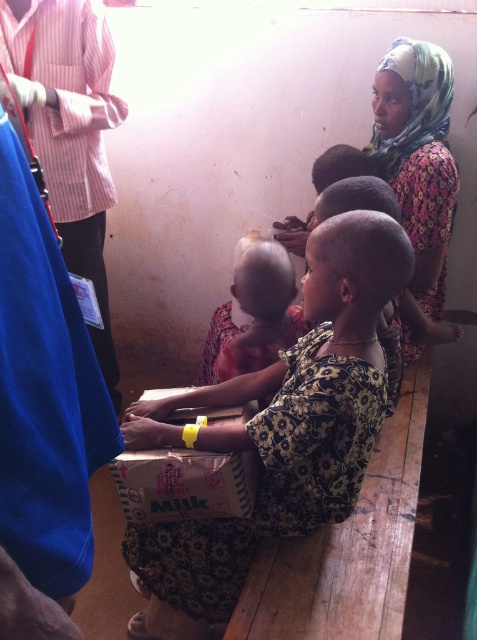
You are a photographer trying to capture the smooth skin baby at center without any obstructions. The floral fabric headscarf at upper right is in your way. Can you adjust your angle to avoid the headscarf?

The floral fabric headscarf at upper right is positioned over the smooth skin baby at center, so adjusting your angle to avoid the headscarf might be possible by moving to a side where the headscarf is no longer blocking the baby.

You are standing in the classroom and need to find the floral fabric dress at center. Based on the coordinates provided, where should you look relative to the other objects in the scene?

The floral fabric dress at center is located at coordinates point (279, 429), which places it centrally in the image. Since there are no other objects with coordinates provided, focus your search around the central area of the scene.

You are standing in the room and want to touch the floral fabric headscarf at upper right. The point you can reach is at coordinate point (417, 156). Is this point on the floral fabric headscarf at upper right?

Yes, the point (417, 156) is on the floral fabric headscarf at upper right.